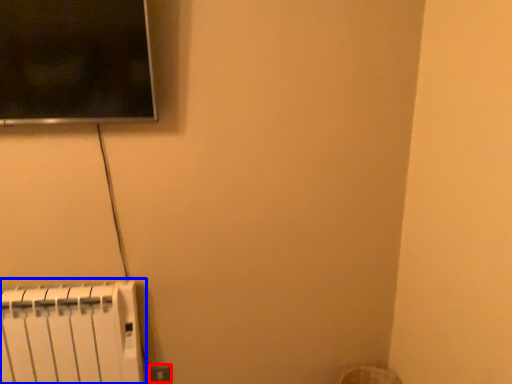
Question: Among these objects, which one is farthest to the camera, electric outlet (highlighted by a red box) or radiator (highlighted by a blue box)?

Choices:
 (A) electric outlet
 (B) radiator

Answer: (A)